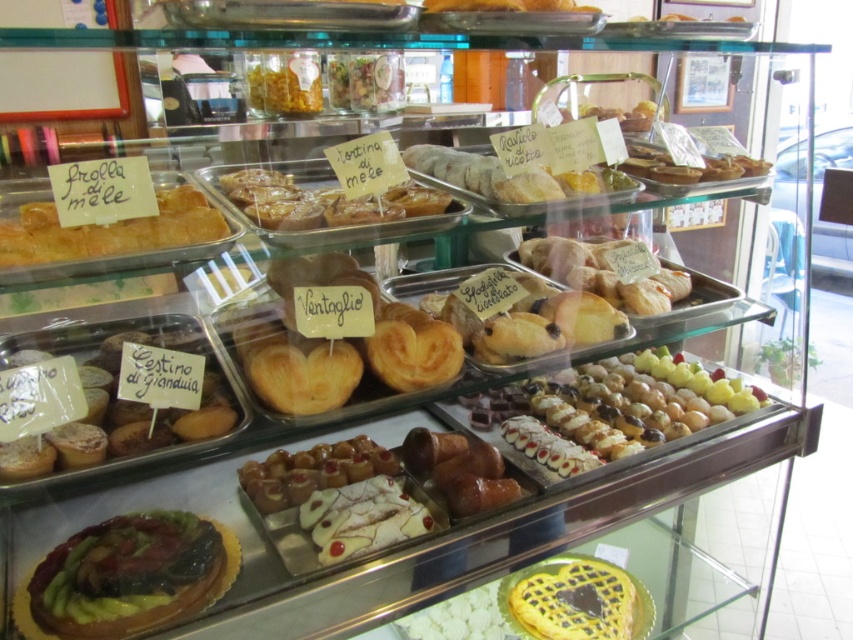
You are a customer at the bakery and want to find the glazed pastry at center. According to the display case layout, where should you look relative to the other items?

The glazed pastry at center is located at point coordinates (622, 406), which places it centrally within the display case, making it easily visible from the front.

You are a customer at the bakery and want to know if the glazed pastry at center is placed above the golden waffle at center. Can you confirm this based on the display?

The glazed pastry at center is positioned over golden waffle at center, so yes, it is placed above the golden waffle at center in the display.

You are a customer at the bakery and want to examine the shiny green and red fruit tart at center closely. The bakery has a rule that customers must stay at least 90 centimeters away from the display case for safety. Can you safely approach the tart without violating the rule?

The shiny green and red fruit tart at center is 89.44 centimeters away from viewer, which is less than the required 90 centimeters. Therefore, approaching it would violate the bakery safety rule.